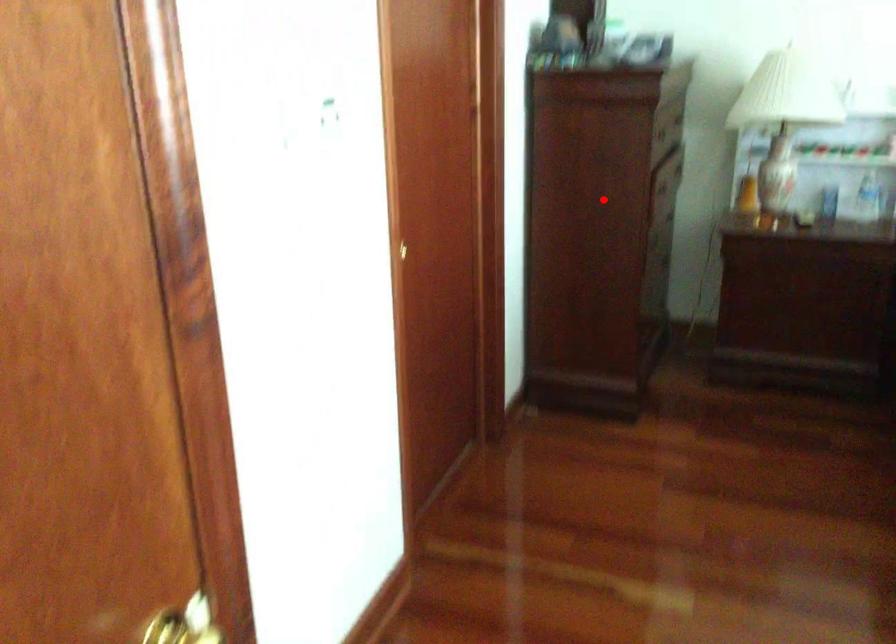
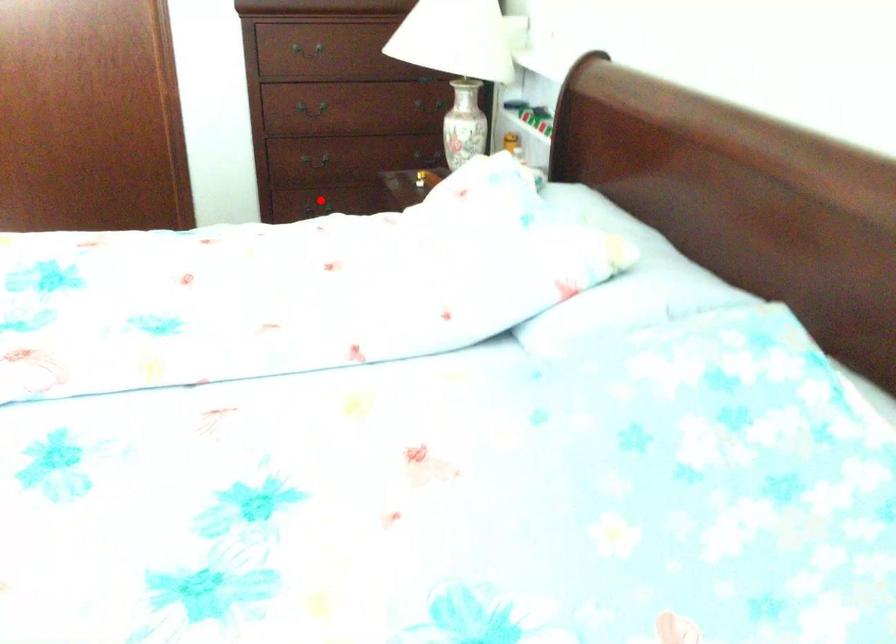
I am providing you with two images of the same scene from different viewpoints. A red point is marked on the first image and another point is marked on the second image. Are the points marked in image1 and image2 representing the same 3D position?

No